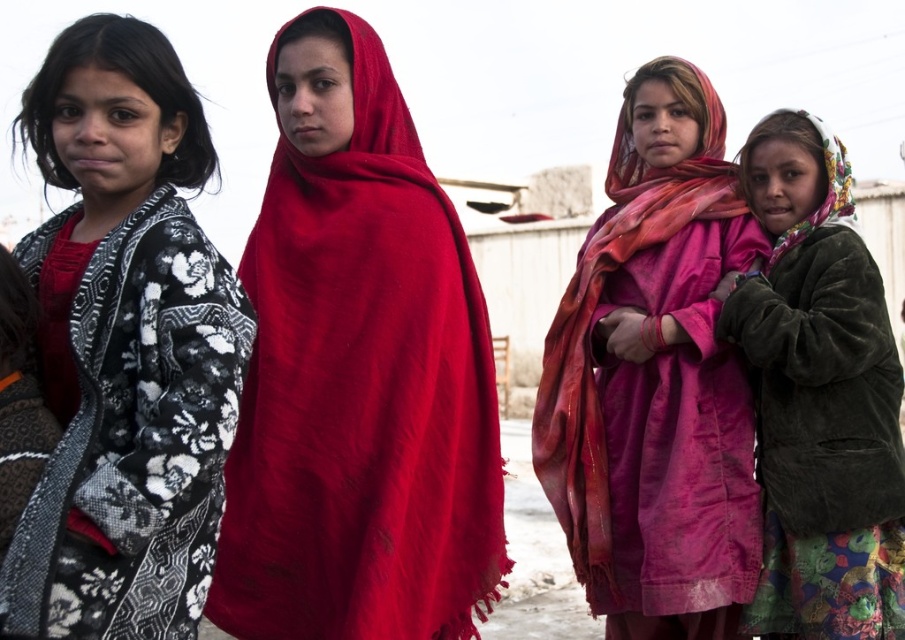
Based on the photo, is matte red shawl at center taller than pink fabric scarf at center?

No, matte red shawl at center is not taller than pink fabric scarf at center.

This screenshot has width=905, height=640. Describe the element at coordinates (362, 392) in the screenshot. I see `matte red shawl at center` at that location.

Locate an element on the screen. This screenshot has height=640, width=905. matte red shawl at center is located at coordinates (362, 392).

Between point (439, 324) and point (218, 483), which one is positioned behind?

Positioned behind is point (439, 324).

Can you confirm if matte red shawl at center is smaller than black and white floral shawl at left?

Actually, matte red shawl at center might be larger than black and white floral shawl at left.

Which is behind, point (444, 337) or point (55, 634)?

Positioned behind is point (444, 337).

Locate an element on the screen. matte red shawl at center is located at coordinates (362, 392).

Looking at this image, between matte red shawl at center and velvet brown jacket at lower right, which one is positioned higher?

matte red shawl at center

Does point (448, 557) lie behind point (884, 560)?

That is True.

Is point (262, 291) in front of point (817, 458)?

No, (262, 291) is further to viewer.

Find the location of a particular element. The height and width of the screenshot is (640, 905). matte red shawl at center is located at coordinates (362, 392).